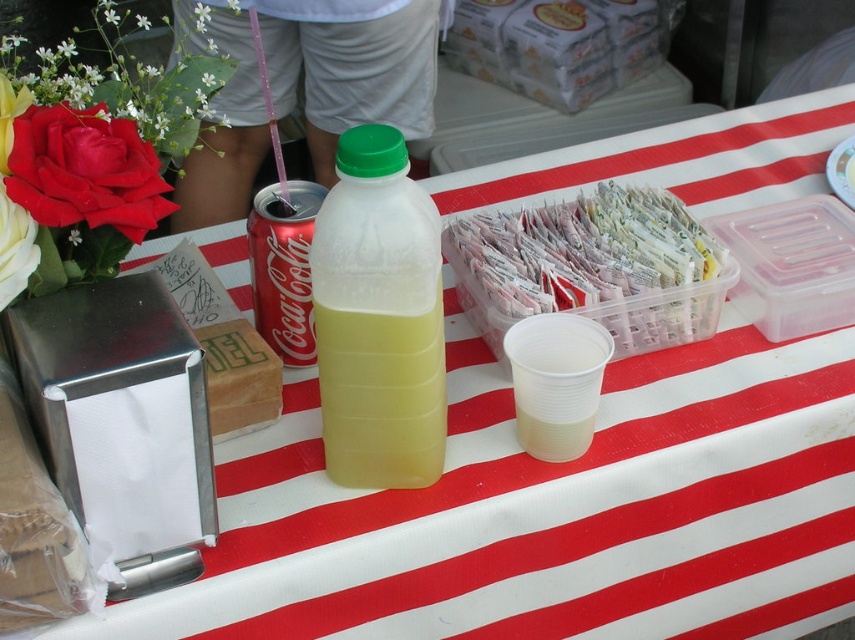
You are setting up a small centerpiece for a party. You have a yellow translucent bottle at center and a white matte flower at upper left. Which object should you place closer to the edge of the table to ensure stability?

The yellow translucent bottle at center might be wider than the white matte flower at upper left, so placing the wider bottle closer to the edge could provide better stability due to its base.

You are at a picnic table and see the silky red rose at upper left and the white matte flower at upper left. Which flower is positioned in front of the other?

The silky red rose at upper left is closer to the viewer than the white matte flower at upper left, so the silky red rose at upper left is positioned in front of the white matte flower at upper left.